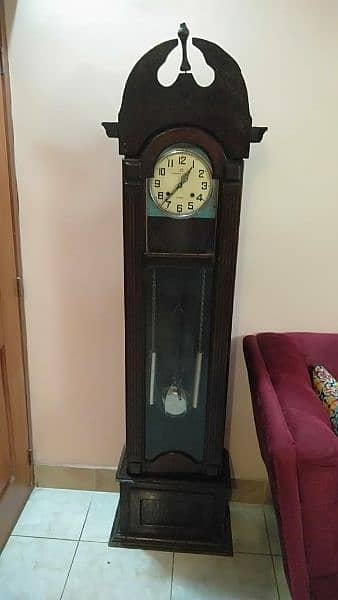
Where is `hinge`? The height and width of the screenshot is (600, 338). hinge is located at coordinates (30, 460).